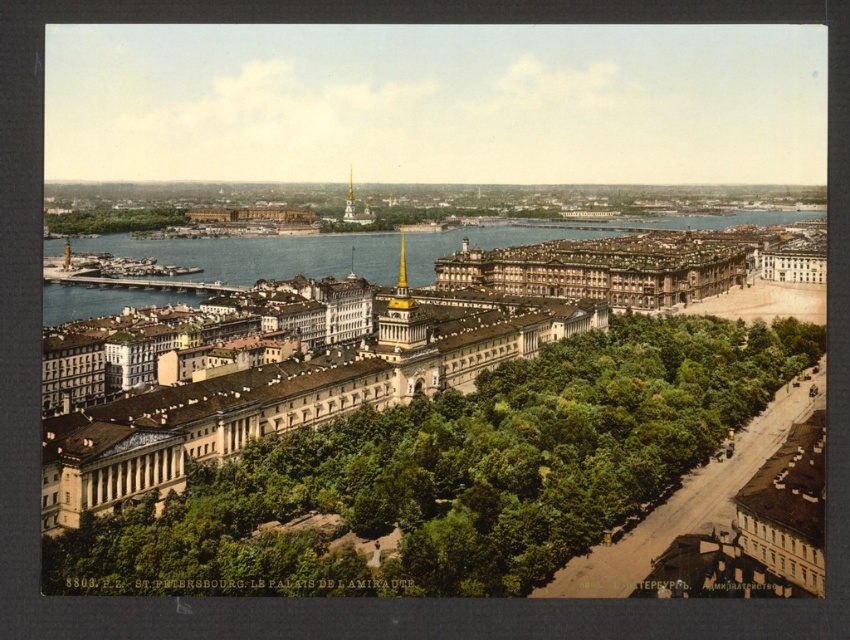
Question: Which object is positioned farthest from the green leafy trees at center?

Choices:
 (A) white stone palace at center
 (B) golden stone palace at center-right
 (C) blue water at center
 (D) green leafy trees at left

Answer: (D)

Question: Which object appears closest to the camera in this image?

Choices:
 (A) white stone palace at center
 (B) golden stone palace at center-right

Answer: (A)

Question: Can you confirm if blue water at center is positioned to the right of green leafy trees at left?

Choices:
 (A) yes
 (B) no

Answer: (A)

Question: Does green leafy trees at center have a larger size compared to blue water at center?

Choices:
 (A) no
 (B) yes

Answer: (A)

Question: Is blue water at center thinner than golden stone palace at center-right?

Choices:
 (A) no
 (B) yes

Answer: (A)

Question: Estimate the real-world distances between objects in this image. Which object is farther from the green leafy trees at center?

Choices:
 (A) blue water at center
 (B) golden stone palace at center-right
 (C) green leafy trees at left

Answer: (C)